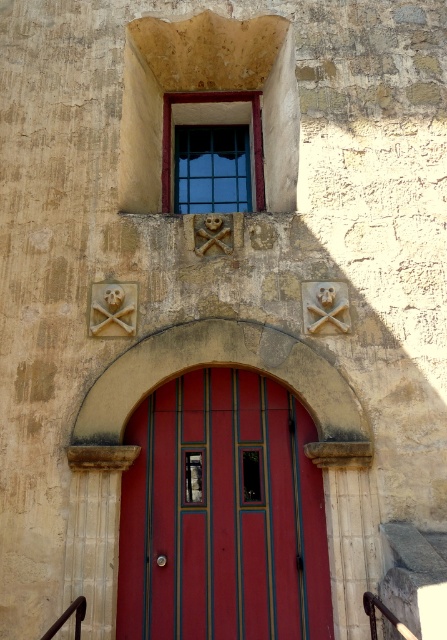
Question: Which object is the closest to the smooth glossy wood door at center?

Choices:
 (A) clear glass window at upper center
 (B) gray stone stair at lower right

Answer: (B)

Question: Can you confirm if smooth glossy wood door at center is positioned to the left of clear glass window at upper center?

Choices:
 (A) no
 (B) yes

Answer: (A)

Question: Which object is the closest to the clear glass window at upper center?

Choices:
 (A) smooth glossy wood door at center
 (B) gray stone stair at lower right

Answer: (A)

Question: Is the position of smooth glossy wood door at center more distant than that of clear glass window at upper center?

Choices:
 (A) yes
 (B) no

Answer: (B)

Question: Which point is farther to the camera?

Choices:
 (A) clear glass window at upper center
 (B) gray stone stair at lower right
 (C) smooth glossy wood door at center

Answer: (A)

Question: Can you confirm if smooth glossy wood door at center is positioned to the left of clear glass window at upper center?

Choices:
 (A) no
 (B) yes

Answer: (A)